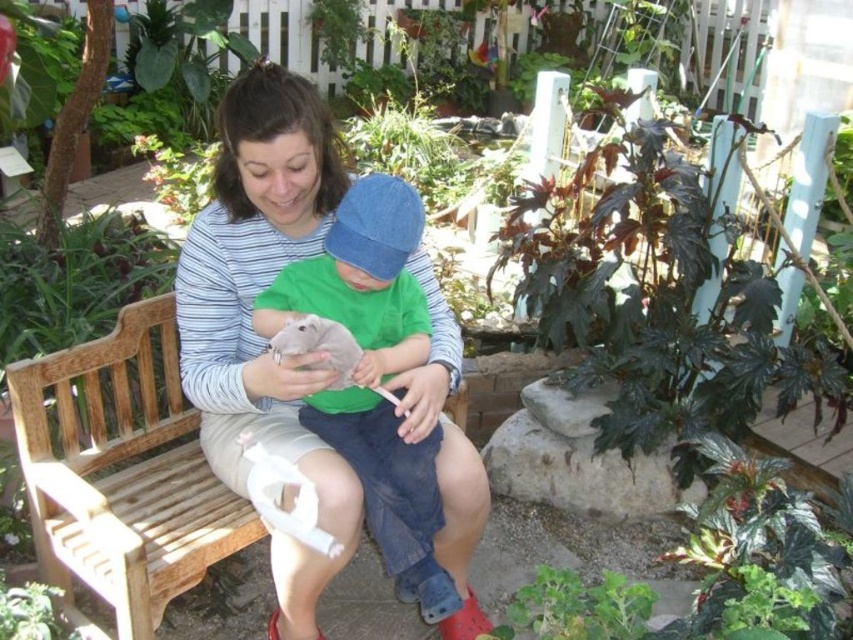
You are a photographer trying to capture a closeup of the green fuzzy plant at lower center without including the denim cap at center in the frame. Based on their positions, is this possible?

The denim cap at center is positioned on the left side of green fuzzy plant at lower center. Since the denim cap is to the left of the plant, you can move the camera slightly to the right to exclude the denim cap at center from the frame while keeping the green fuzzy plant at lower center in focus.

You are standing in the garden and want to sit on the wooden bench at center. To do so, should you walk to the left or right of the green leafy plant at upper center?

You should walk to the right of the green leafy plant at upper center because the wooden bench at center is located to the right of it.